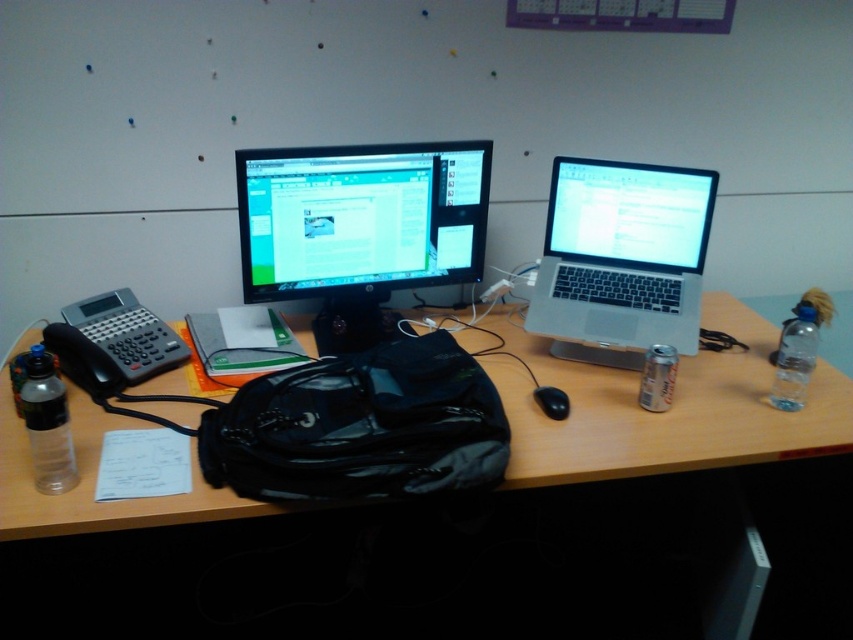
You are standing in front of the desk and want to reach a point exactly 1.5 meters away from you. Is the point at coordinates point (317, 269) within that distance?

The distance between point (317, 269) and the viewer is 1.62 meters, which is farther than 1.5 meters. Therefore, the point is outside the desired range.

You are organizing cables on the desk and need to plug a new USB cable into the black matte mouse at center. The cable is 1 meter long. The matte black monitor at center is in the way. Can you reach the mouse without moving the monitor?

The matte black monitor at center is further to the viewer than black matte mouse at center, so the mouse is closer to you. Since the cable is 1 meter long, you should be able to reach the mouse without moving the monitor.